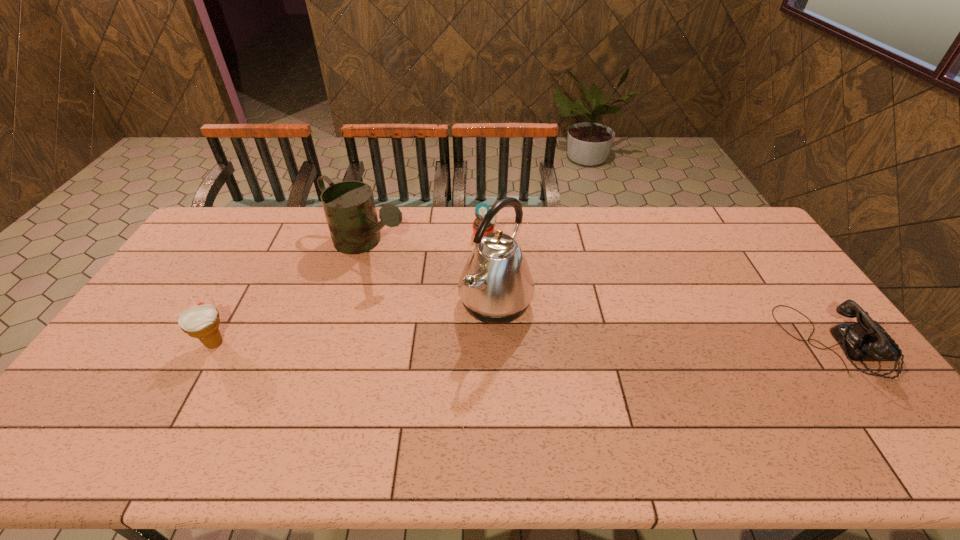
This screenshot has height=540, width=960. Find the location of `vacant space on the desktop that is between the leftmost object and the telephone and is positioned from the spout of the tallest object`. vacant space on the desktop that is between the leftmost object and the telephone and is positioned from the spout of the tallest object is located at coordinates (575, 343).

The width and height of the screenshot is (960, 540). Find the location of `free space on the desktop that is between the icecream and the rightmost object and is positioned on the front-facing side of the muffin`. free space on the desktop that is between the icecream and the rightmost object and is positioned on the front-facing side of the muffin is located at coordinates (564, 343).

Where is `free spot on the desktop that is between the icecream and the telephone and is positioned with the spout on the fourth object from right to left`? free spot on the desktop that is between the icecream and the telephone and is positioned with the spout on the fourth object from right to left is located at coordinates (511, 343).